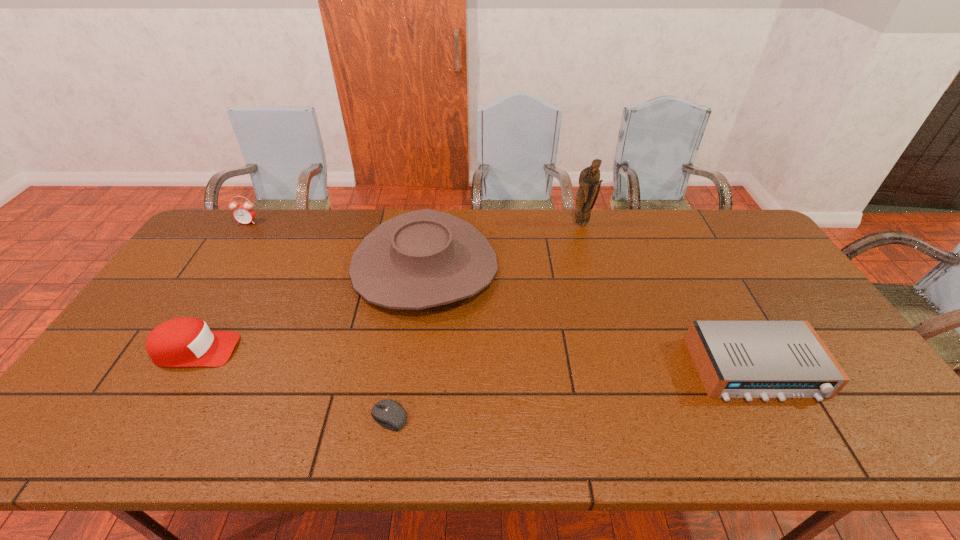
Identify the location of unoccupied position between the radio receiver and the computer equipment. The image size is (960, 540). (572, 393).

Find the location of a particular element. Image resolution: width=960 pixels, height=540 pixels. vacant space that is in between the cowboy hat and the figurine is located at coordinates (503, 245).

Where is `blank region between the cowboy hat and the rightmost object`? The width and height of the screenshot is (960, 540). blank region between the cowboy hat and the rightmost object is located at coordinates (590, 318).

Where is `vacant area that lies between the computer equipment and the radio receiver`? This screenshot has width=960, height=540. vacant area that lies between the computer equipment and the radio receiver is located at coordinates click(x=572, y=393).

This screenshot has width=960, height=540. Find the location of `free space between the baseball cap and the computer equipment`. free space between the baseball cap and the computer equipment is located at coordinates (293, 383).

Locate an element on the screen. The width and height of the screenshot is (960, 540). object that stands as the fourth closest to the baseball cap is located at coordinates (589, 181).

Select which object is the second closest to the figurine. Please provide its 2D coordinates. Your answer should be formatted as a tuple, i.e. [(x, y)], where the tuple contains the x and y coordinates of a point satisfying the conditions above.

[(735, 359)]

At what (x,y) coordinates should I click in order to perform the action: click on vacant region that satisfies the following two spatial constraints: 1. on the front-facing side of the computer equipment; 2. on the right side of the baseball cap. Please return your answer as a coordinate pair (x, y). This screenshot has height=540, width=960. Looking at the image, I should click on (156, 417).

Locate an element on the screen. vacant region that satisfies the following two spatial constraints: 1. on the front-facing side of the second object from right to left; 2. on the front-facing side of the third shortest object is located at coordinates (617, 350).